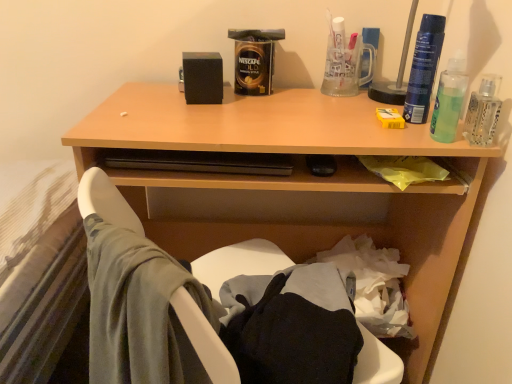
The width and height of the screenshot is (512, 384). Find the location of `free space behind clear glass bottle at upper right, the first bottle in the right-to-left sequence`. free space behind clear glass bottle at upper right, the first bottle in the right-to-left sequence is located at coordinates (424, 124).